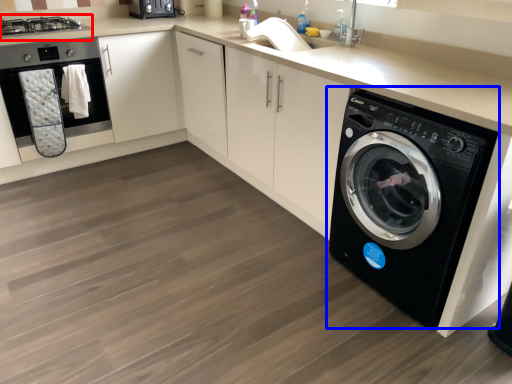
Question: Which of the following is the farthest to the observer, stove (highlighted by a red box) or washing machine (highlighted by a blue box)?

Choices:
 (A) stove
 (B) washing machine

Answer: (A)